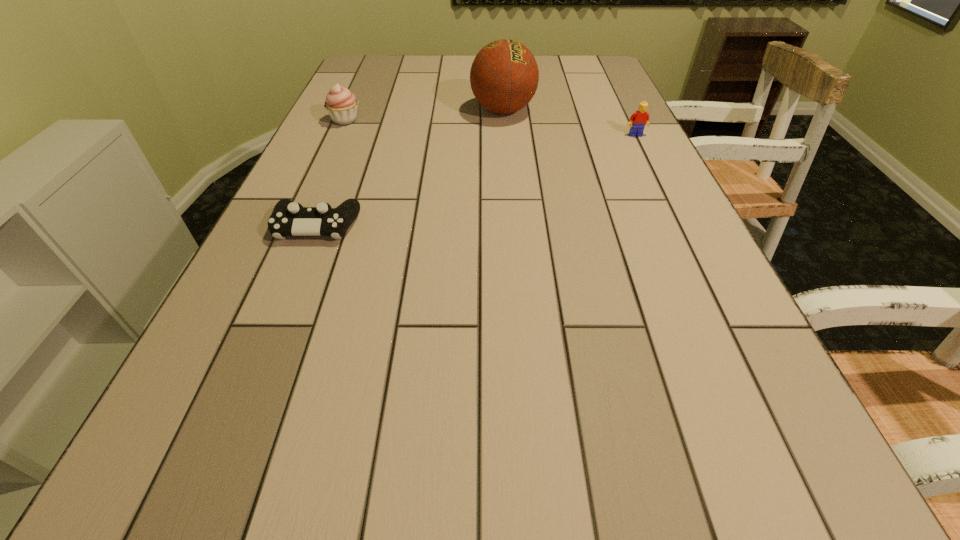
Identify which object is the second nearest to the third farthest object. Please provide its 2D coordinates. Your answer should be formatted as a tuple, i.e. [(x, y)], where the tuple contains the x and y coordinates of a point satisfying the conditions above.

[(288, 218)]